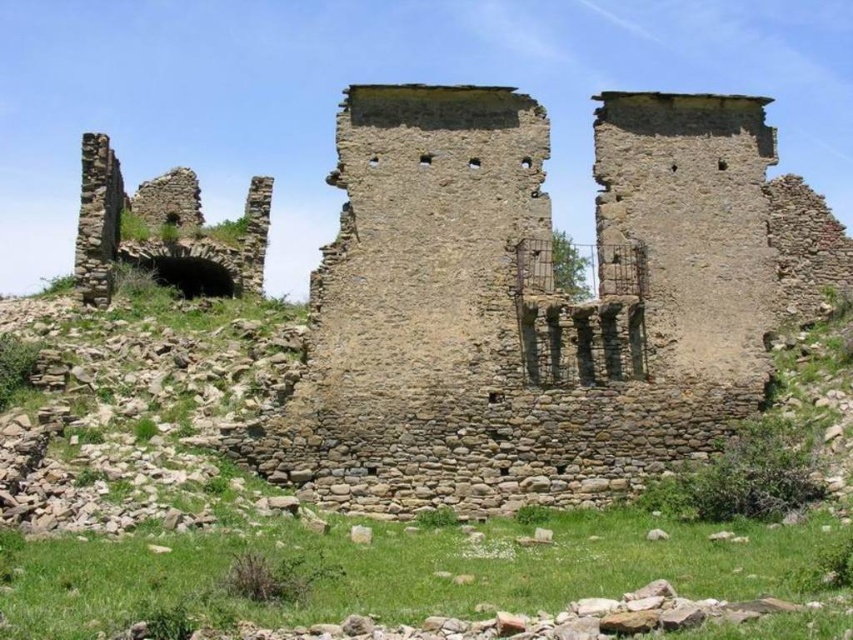
Question: Which point is closer to the camera?

Choices:
 (A) (103, 252)
 (B) (614, 344)

Answer: (B)

Question: Which point appears closest to the camera in this image?

Choices:
 (A) (206, 284)
 (B) (598, 145)

Answer: (B)

Question: Which point is closer to the camera?

Choices:
 (A) rustic stone arch at left
 (B) rustic stone castle at center

Answer: (B)

Question: Can you confirm if rustic stone castle at center is bigger than rustic stone arch at left?

Choices:
 (A) no
 (B) yes

Answer: (B)

Question: Is rustic stone castle at center in front of rustic stone arch at left?

Choices:
 (A) yes
 (B) no

Answer: (A)

Question: Can you confirm if rustic stone castle at center is positioned above rustic stone arch at left?

Choices:
 (A) yes
 (B) no

Answer: (B)